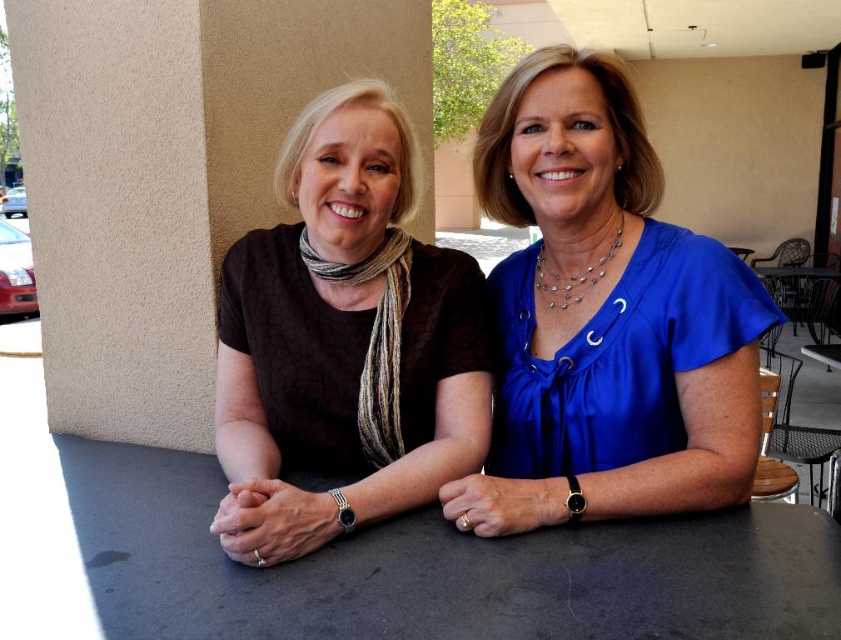
Who is positioned more to the left, blue silk blouse at center or matte brown blouse at center?

matte brown blouse at center

Locate an element on the screen. blue silk blouse at center is located at coordinates (606, 317).